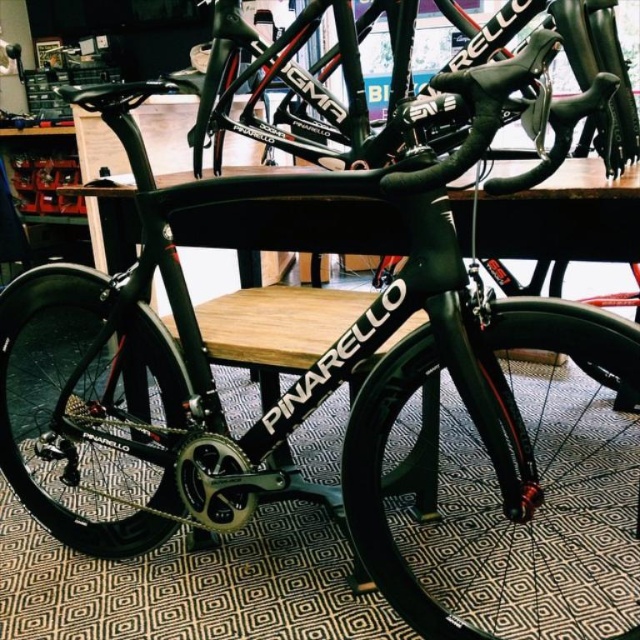
Question: Does matte black wheel at center appear on the right side of black carbon fiber wheel at center?

Choices:
 (A) yes
 (B) no

Answer: (B)

Question: Can you confirm if matte black wheel at center is thinner than black carbon fiber wheel at center?

Choices:
 (A) no
 (B) yes

Answer: (A)

Question: Which object appears farthest from the camera in this image?

Choices:
 (A) black carbon fiber wheel at center
 (B) matte black wheel at center

Answer: (B)

Question: Is matte black wheel at center above black carbon fiber wheel at center?

Choices:
 (A) no
 (B) yes

Answer: (B)